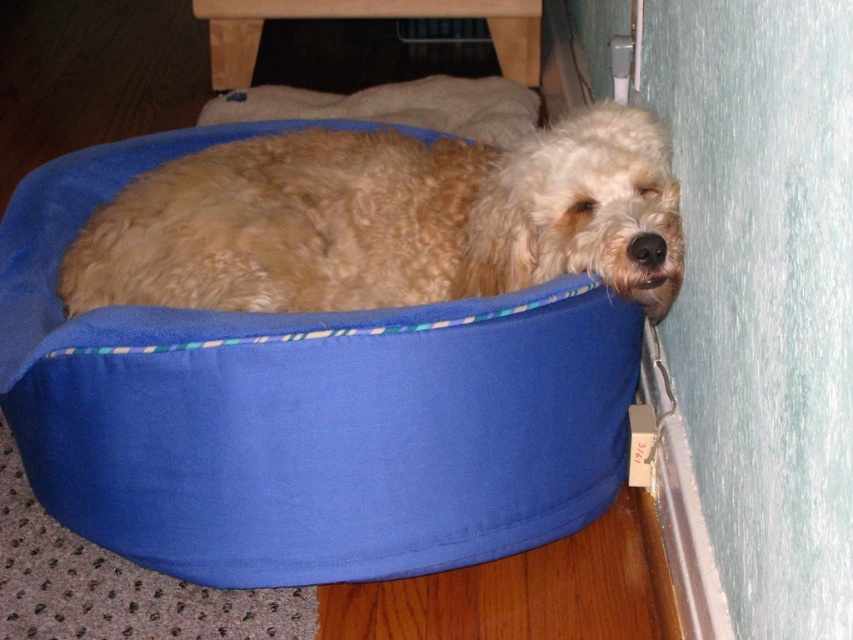
Does blue fabric dog bed at lower left appear on the right side of fluffy golden dog at lower right?

In fact, blue fabric dog bed at lower left is to the left of fluffy golden dog at lower right.

Does point (216, 541) come behind point (163, 253)?

No, (216, 541) is in front of (163, 253).

Does point (364, 429) come closer to viewer compared to point (258, 230)?

Yes, point (364, 429) is closer to viewer.

Identify the location of blue fabric dog bed at lower left. This screenshot has width=853, height=640. (303, 410).